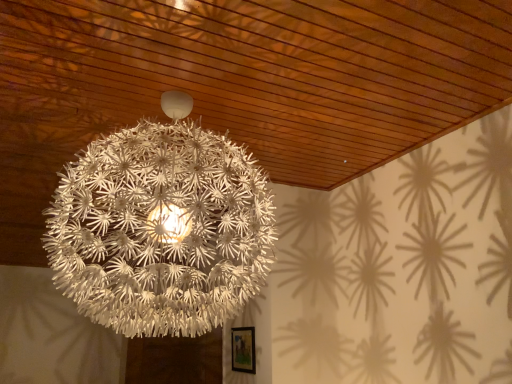
Question: Should I look upward or downward to see white matte spherical lamp at center?

Choices:
 (A) up
 (B) down

Answer: (B)

Question: Is the surface of wooden framed picture at lower center in direct contact with white matte spherical lamp at center?

Choices:
 (A) no
 (B) yes

Answer: (A)

Question: Is wooden framed picture at lower center not within white matte spherical lamp at center?

Choices:
 (A) yes
 (B) no

Answer: (A)

Question: From a real-world perspective, is wooden framed picture at lower center under white matte spherical lamp at center?

Choices:
 (A) yes
 (B) no

Answer: (A)

Question: Can you confirm if wooden framed picture at lower center is wider than white matte spherical lamp at center?

Choices:
 (A) yes
 (B) no

Answer: (B)

Question: Can you confirm if wooden framed picture at lower center is thinner than white matte spherical lamp at center?

Choices:
 (A) no
 (B) yes

Answer: (B)

Question: Is wooden framed picture at lower center shorter than white matte spherical lamp at center?

Choices:
 (A) no
 (B) yes

Answer: (B)

Question: Is wooden framed picture at lower center inside white matte spherical lamp at center?

Choices:
 (A) yes
 (B) no

Answer: (B)

Question: Is white matte spherical lamp at center positioned with its back to wooden framed picture at lower center?

Choices:
 (A) yes
 (B) no

Answer: (B)

Question: Can you confirm if white matte spherical lamp at center is wider than wooden framed picture at lower center?

Choices:
 (A) yes
 (B) no

Answer: (A)

Question: Considering the relative positions of white matte spherical lamp at center and wooden framed picture at lower center in the image provided, is white matte spherical lamp at center in front of wooden framed picture at lower center?

Choices:
 (A) no
 (B) yes

Answer: (B)

Question: Is white matte spherical lamp at center aimed at wooden framed picture at lower center?

Choices:
 (A) no
 (B) yes

Answer: (A)

Question: Is white matte spherical lamp at center completely or partially outside of wooden framed picture at lower center?

Choices:
 (A) no
 (B) yes

Answer: (B)

Question: From a real-world perspective, relative to wooden framed picture at lower center, is white matte spherical lamp at center vertically above or below?

Choices:
 (A) above
 (B) below

Answer: (A)